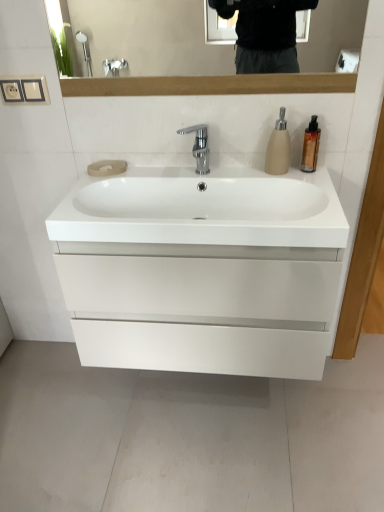
You are a GUI agent. You are given a task and a screenshot of the screen. Output one action in this format:
    pyautogui.click(x=<x>, y=<y>)
    Task: Click on the free point below white glossy cabinet at center (from a real-world perspective)
    
    Given the screenshot: What is the action you would take?
    pyautogui.click(x=207, y=395)